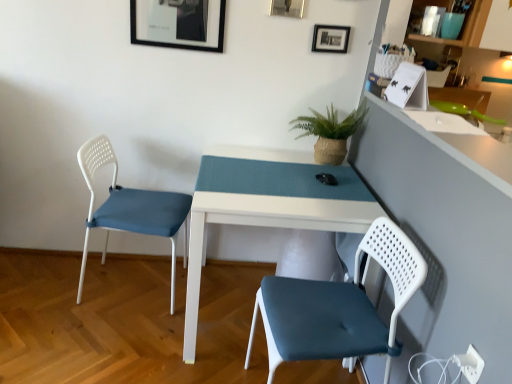
You are a GUI agent. You are given a task and a screenshot of the screen. Output one action in this format:
    pyautogui.click(x=<x>, y=<y>)
    Task: Click on the vacant space in front of white plastic chair at left, the 1th chair viewed from the left
    Image resolution: width=512 pixels, height=384 pixels.
    Given the screenshot: What is the action you would take?
    pyautogui.click(x=102, y=347)